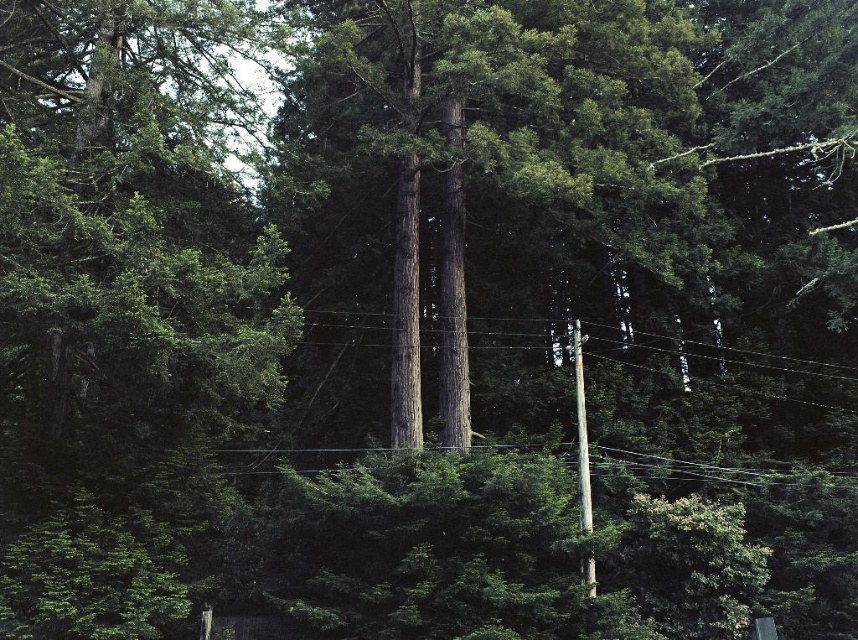
Which is behind, point (361, 312) or point (771, 484)?

Positioned behind is point (361, 312).

Which of these two, brown wooden power line at center or black wire at center, stands shorter?

black wire at center

Does point (621, 348) come in front of point (784, 477)?

No, it is behind (784, 477).

This screenshot has width=858, height=640. In order to click on brown wooden power line at center in this screenshot , I will do `click(754, 358)`.

Locate an element on the screen. Image resolution: width=858 pixels, height=640 pixels. black wire at center is located at coordinates (718, 468).

Find the location of a particular element. This screenshot has width=858, height=640. black wire at center is located at coordinates (718, 468).

Can you confirm if brown wooden power line at center is smaller than smooth gray wood telegraph pole at center-right?

Actually, brown wooden power line at center might be larger than smooth gray wood telegraph pole at center-right.

Does brown wooden power line at center have a lesser height compared to smooth gray wood telegraph pole at center-right?

Correct, brown wooden power line at center is not as tall as smooth gray wood telegraph pole at center-right.

Which is behind, point (799, 371) or point (581, 508)?

Point (799, 371)

Identify the location of brown wooden power line at center. The height and width of the screenshot is (640, 858). (754, 358).